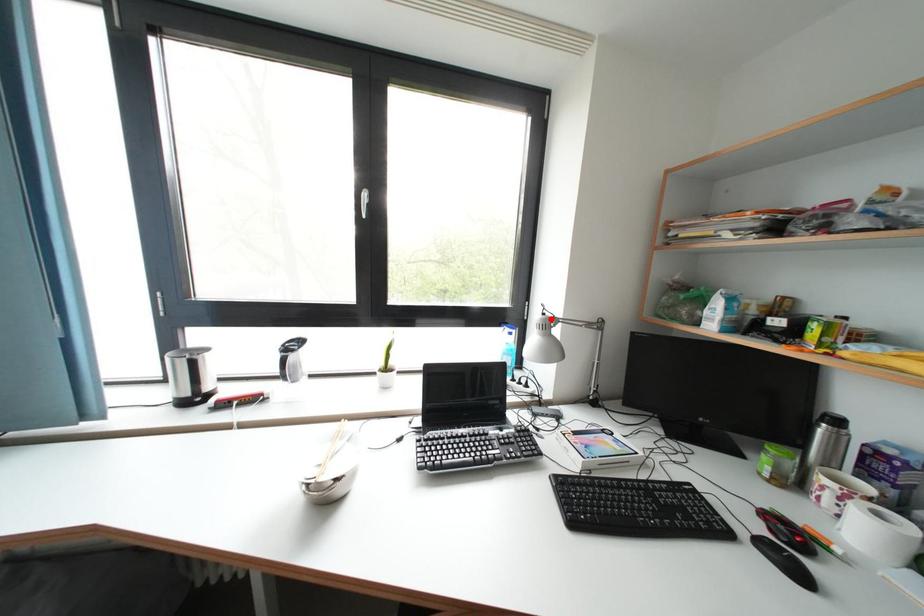
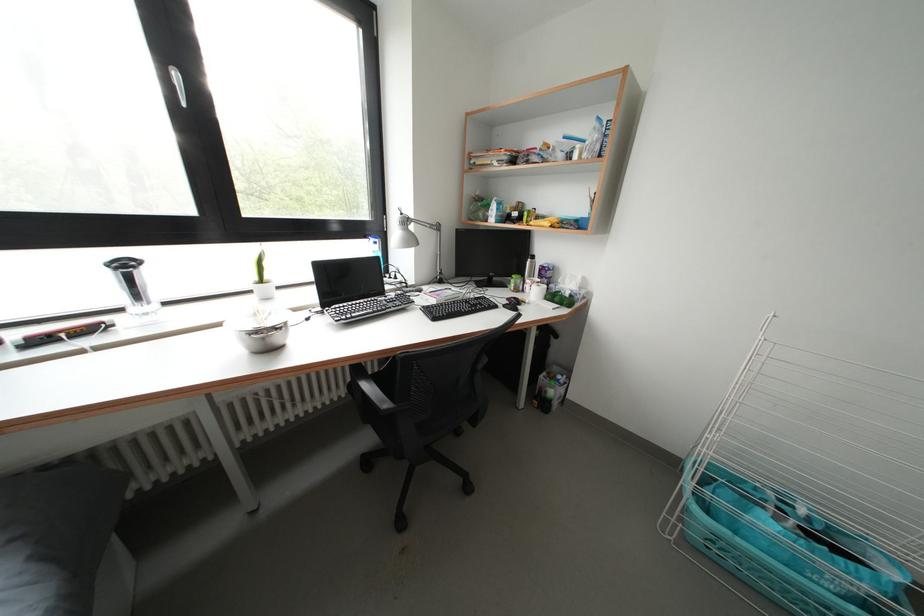
The point at the highlighted location is marked in the first image. Where is the corresponding point in the second image?

(408, 219)